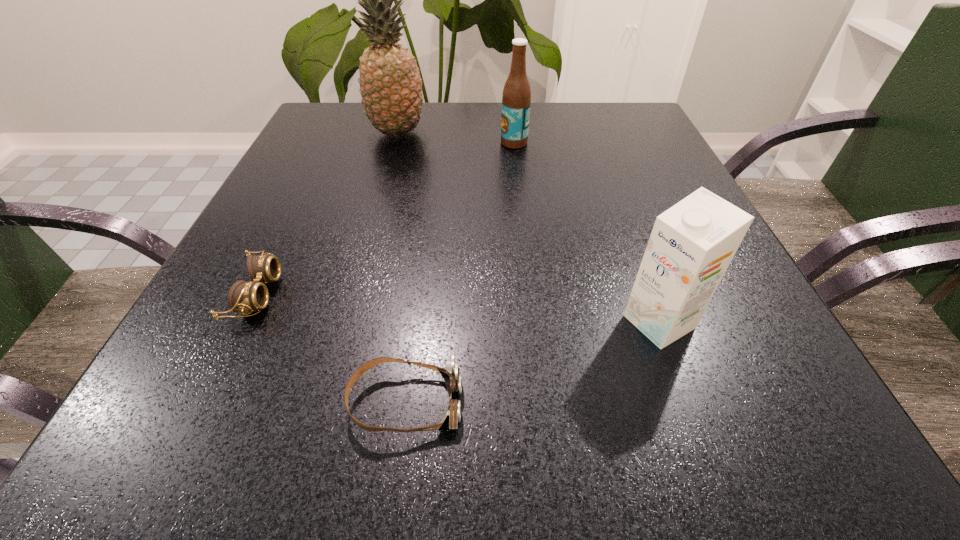
The width and height of the screenshot is (960, 540). What are the coordinates of `free region located through the lenses of the leftmost object` in the screenshot? It's located at (399, 294).

Find the location of a particular element. vacant area located 0.160m on the front-facing side of the right goggles is located at coordinates (589, 403).

Locate an element on the screen. pineapple present at the far edge is located at coordinates (390, 84).

Find the location of a particular element. The height and width of the screenshot is (540, 960). beer bottle at the far edge is located at coordinates (516, 99).

Find the location of a particular element. The image size is (960, 540). object that is positioned at the near edge is located at coordinates coord(451,375).

Image resolution: width=960 pixels, height=540 pixels. In order to click on pineapple present at the left edge in this screenshot , I will do `click(390, 84)`.

The width and height of the screenshot is (960, 540). In order to click on goggles at the left edge in this screenshot , I will do `click(243, 296)`.

At what (x,y) coordinates should I click in order to perform the action: click on object at the right edge. Please return your answer as a coordinate pair (x, y). Image resolution: width=960 pixels, height=540 pixels. Looking at the image, I should click on pos(692,243).

The image size is (960, 540). In order to click on object positioned at the far left corner in this screenshot , I will do `click(390, 84)`.

Find the location of `vacant point at the far edge`. vacant point at the far edge is located at coordinates (459, 145).